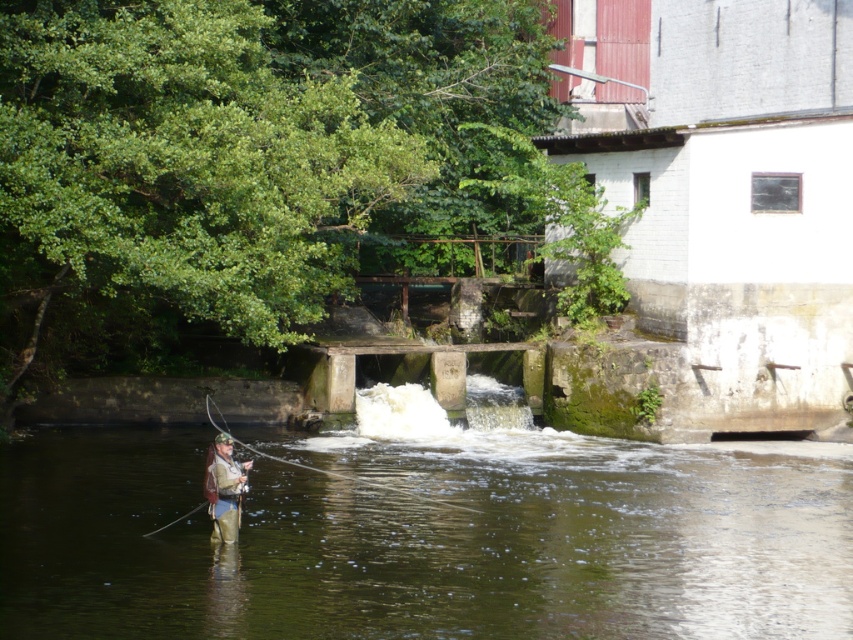
You are a hiker who wants to cross the river using the green mossy stone at center and the camouflage jacket at center as stepping stones. Which one can you step on first?

The green mossy stone at center has a larger size compared to camouflage jacket at center, so you can step on the green mossy stone at center first as it provides a more stable surface.

You are a photographer wanting to capture the fly fisherman in the scene. You notice the green mossy stone at center and the camouflage jacket at center. Which object is wider when viewed from your position? Please answer based on their widths.

The green mossy stone at center is wider than the camouflage jacket at center, so the green mossy stone at center is wider.